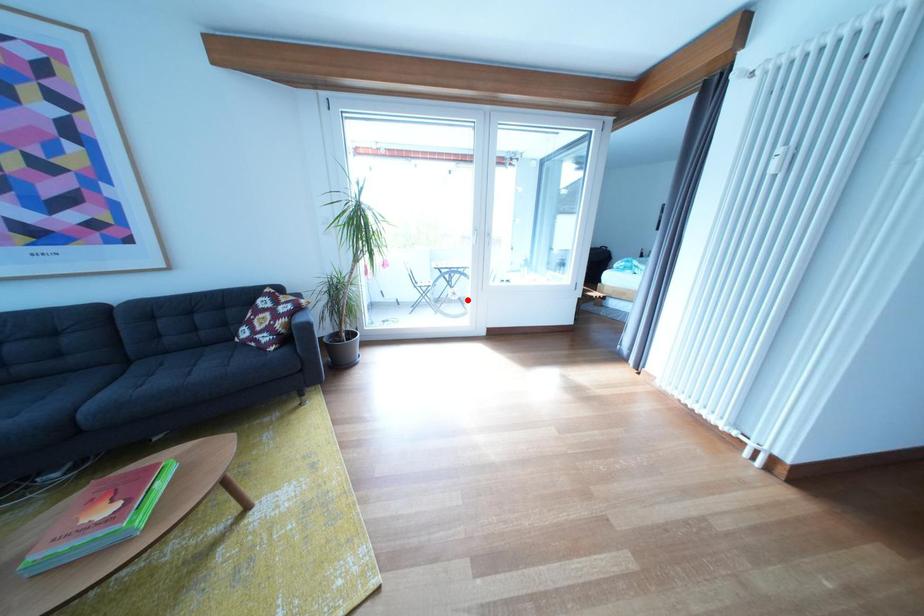
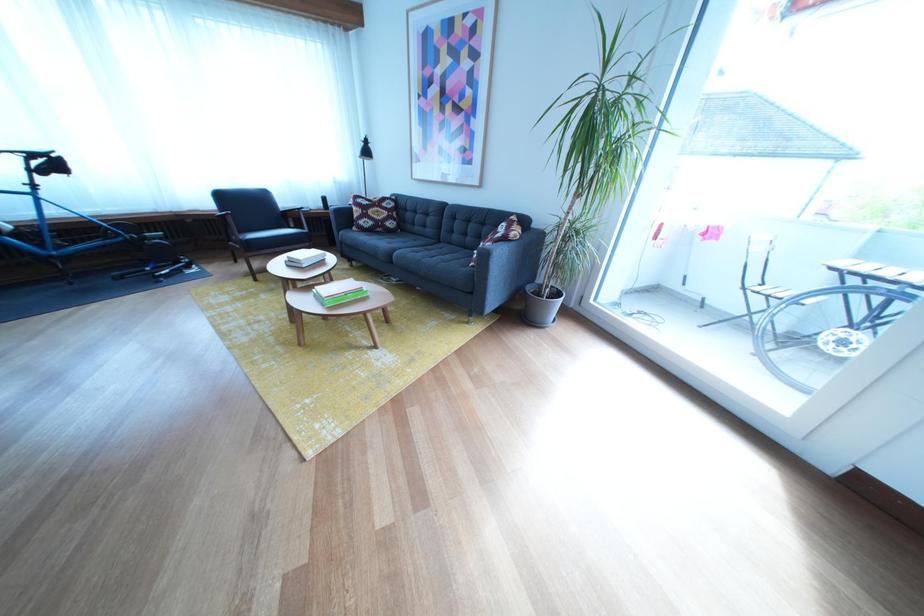
Question: I am providing you with two images of the same scene from different viewpoints. In image1, a red point is highlighted. Considering the same 3D point in image2, which of the following is correct?

Choices:
 (A) It is closer
 (B) It is farther

Answer: (B)